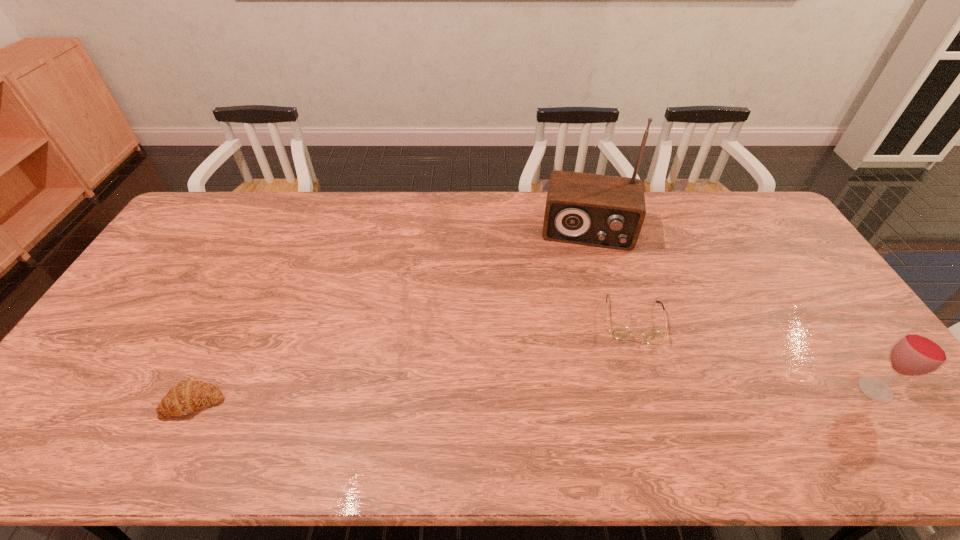
Where is `vacant space on the desktop that is between the crescent roll and the wineglass and is positioned on the lenses of the third nearest object`? The image size is (960, 540). vacant space on the desktop that is between the crescent roll and the wineglass and is positioned on the lenses of the third nearest object is located at coordinates (638, 394).

Identify the location of free spot on the desktop that is between the crescent roll and the wineglass and is positioned on the front-facing side of the tallest object. (582, 395).